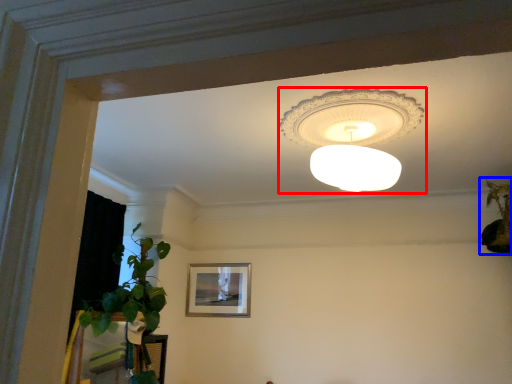
Question: Among these objects, which one is nearest to the camera, lamp (highlighted by a red box) or houseplant (highlighted by a blue box)?

Choices:
 (A) lamp
 (B) houseplant

Answer: (A)